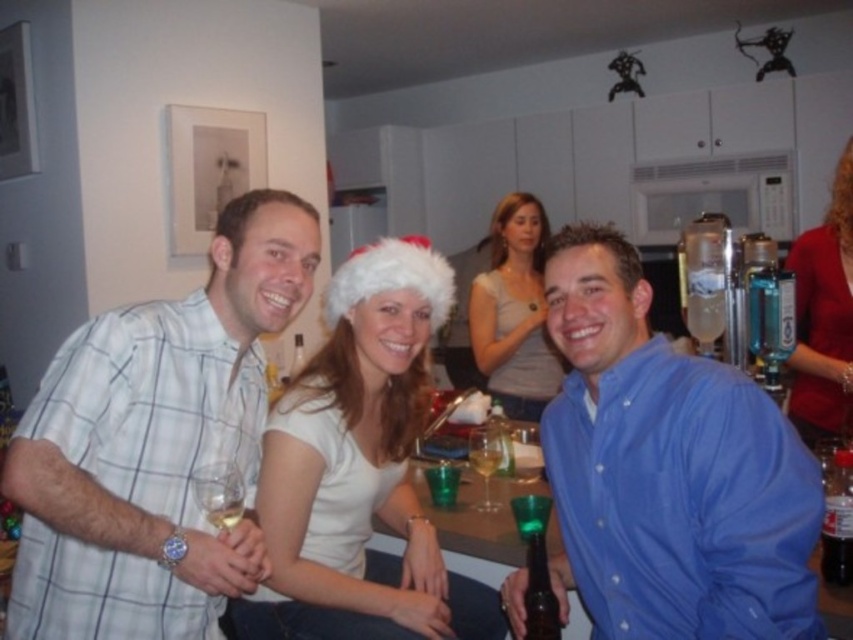
You are a bartender at the party and need to pour a drink using both the green glass bottle at lower center and the translucent glass at lower left. Which container should you use to hold the liquid if you want to serve a larger portion?

The green glass bottle at lower center should be used to hold the liquid because it is larger in size than the translucent glass at lower left, allowing for a larger portion.

You are standing in the kitchen at the party and need to reach the red velvet sweater at upper right. What is the exact coordinate where you should look to find it?

The red velvet sweater at upper right is located at coordinate point (824, 316).